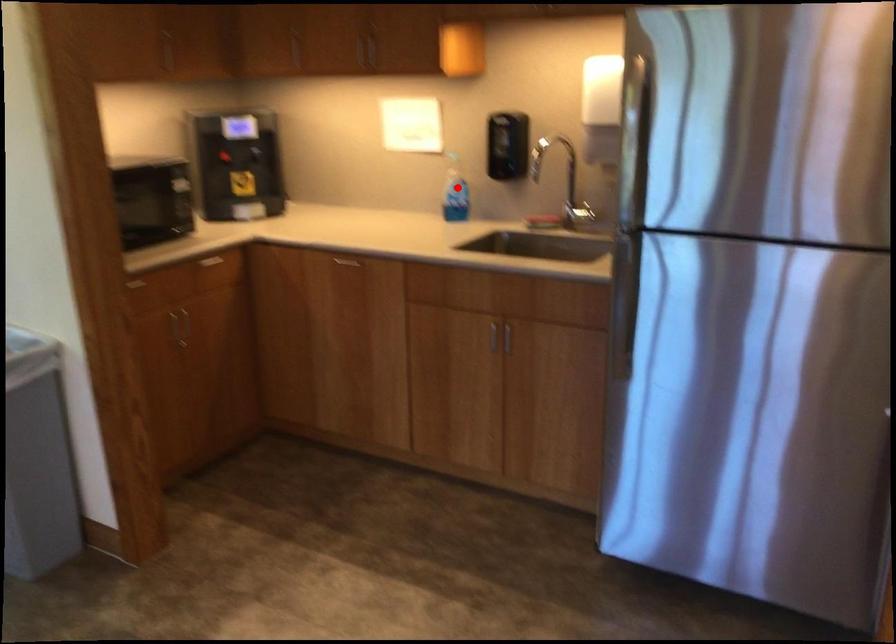
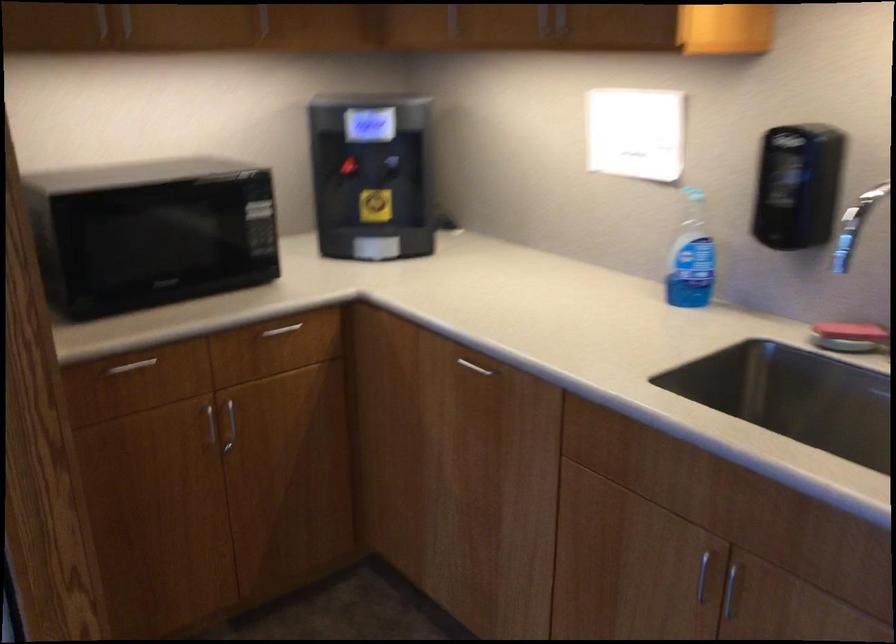
Question: A red point is marked in image1. In image2, is the corresponding 3D point closer to the camera or farther? Reply with the corresponding letter.

Choices:
 (A) The corresponding 3D point is closer.
 (B) The corresponding 3D point is farther.

Answer: (A)